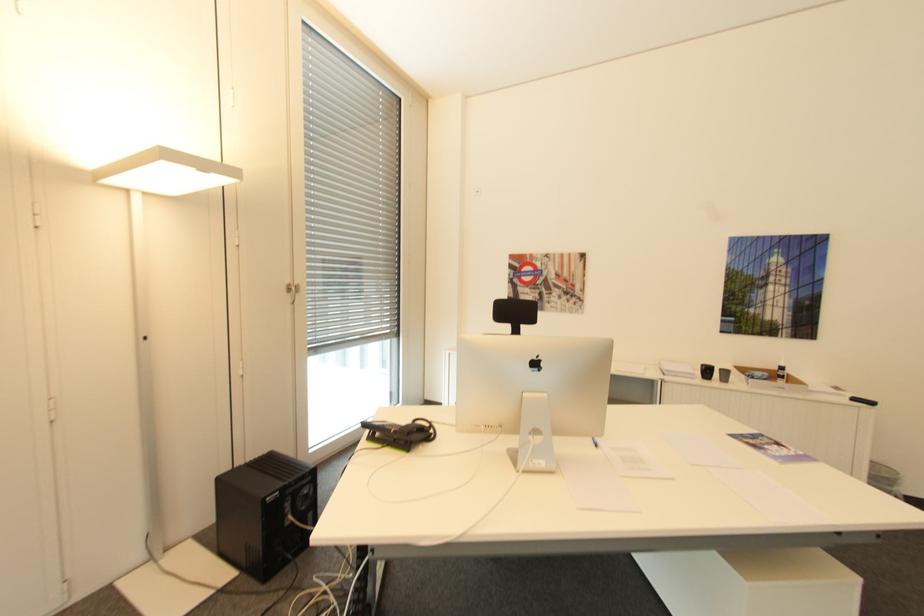
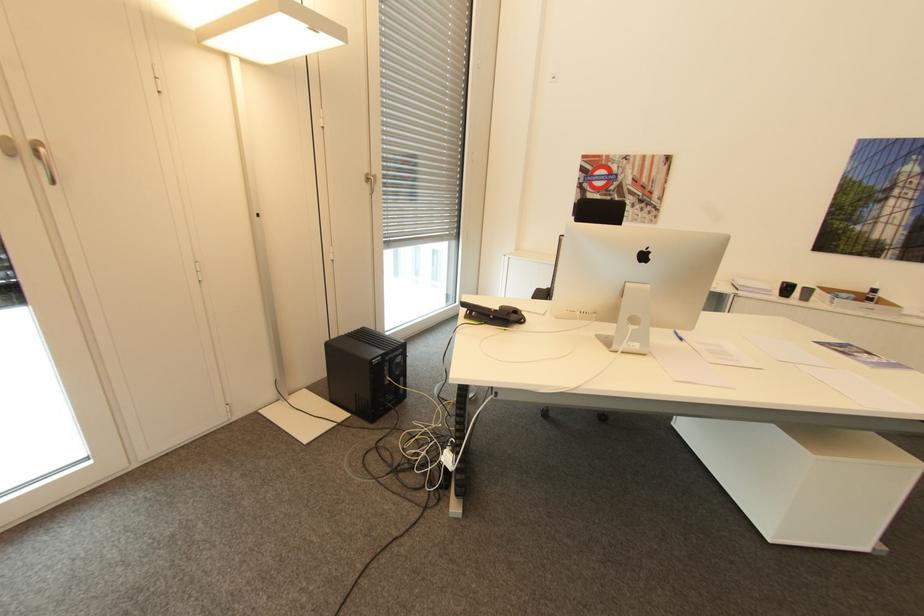
Where in the second image is the point corresponding to [426,428] from the first image?

(520, 310)